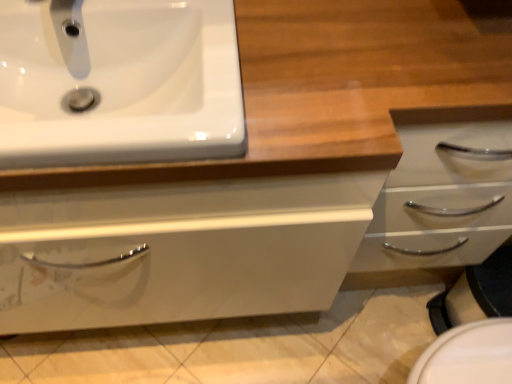
Question: Is white glossy sink at upper left spatially inside matte white faucet at upper left, or outside of it?

Choices:
 (A) inside
 (B) outside

Answer: (B)

Question: From the image's perspective, relative to matte white faucet at upper left, is white glossy sink at upper left above or below?

Choices:
 (A) above
 (B) below

Answer: (B)

Question: From their relative heights in the image, would you say white glossy sink at upper left is taller or shorter than matte white faucet at upper left?

Choices:
 (A) short
 (B) tall

Answer: (A)

Question: From a real-world perspective, relative to white glossy sink at upper left, is matte white faucet at upper left vertically above or below?

Choices:
 (A) below
 (B) above

Answer: (B)

Question: Based on their sizes in the image, would you say matte white faucet at upper left is bigger or smaller than white glossy sink at upper left?

Choices:
 (A) big
 (B) small

Answer: (B)

Question: Is matte white faucet at upper left taller or shorter than white glossy sink at upper left?

Choices:
 (A) tall
 (B) short

Answer: (A)

Question: From the image's perspective, is matte white faucet at upper left above or below white glossy sink at upper left?

Choices:
 (A) above
 (B) below

Answer: (A)